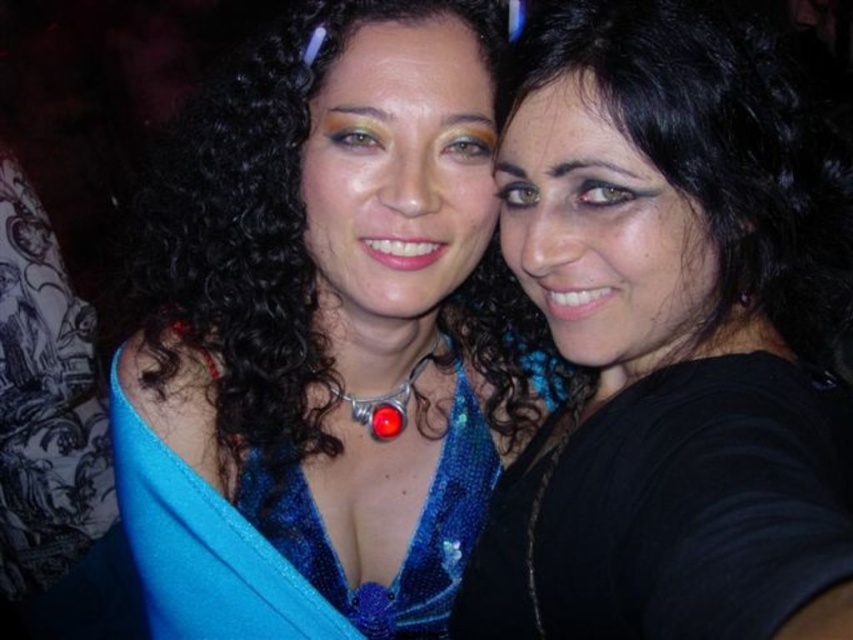
You are a photographer trying to capture a clear shot of both the black matte hair at center and the shiny blue sequined dress at center. Based on their positions, which object is wider and might require more space in the frame?

The black matte hair at center is wider than the shiny blue sequined dress at center according to the description, so it might require more space in the frame.

You are a photographer trying to capture a candid shot of the two people in the image. The camera you are using has a minimum focusing distance of 60 centimeters. Based on the distance between the blue sequined dress at center and the other person, can you take a clear photo without blurring either subject?

The two individuals are 70.27 centimeters apart, which is beyond the camera minimum focusing distance of 60 centimeters. Therefore, the photographer can take a clear photo without blurring either subject.